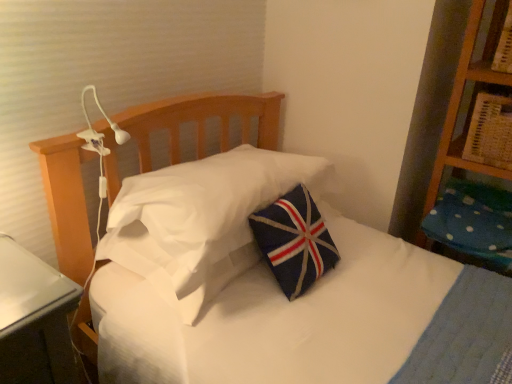
Question: Is point (495, 193) positioned closer to the camera than point (239, 269)?

Choices:
 (A) farther
 (B) closer

Answer: (A)

Question: From their relative heights in the image, would you say blue dotted fabric pillow at right, acting as the 2th pillow starting from the left, is taller or shorter than navy felt pillow at center, placed as the 1th pillow when sorted from left to right?

Choices:
 (A) short
 (B) tall

Answer: (B)

Question: Estimate the real-world distances between objects in this image. Which object is farther from the wooden bookshelf at upper right?

Choices:
 (A) blue dotted fabric pillow at right, acting as the first pillow starting from the right
 (B) navy felt pillow at center, the 2th pillow in the right-to-left sequence

Answer: (B)

Question: Estimate the real-world distances between objects in this image. Which object is closer to the wooden bookshelf at upper right?

Choices:
 (A) blue dotted fabric pillow at right, acting as the 2th pillow starting from the left
 (B) navy felt pillow at center, the 2th pillow in the right-to-left sequence

Answer: (A)